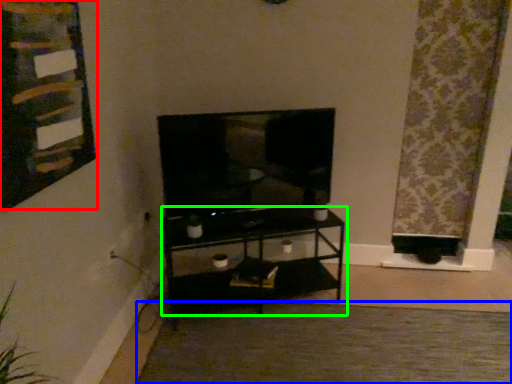
Question: Based on their relative distances, which object is nearer to bulletin board (highlighted by a red box)? Choose from plain (highlighted by a blue box) and shelf (highlighted by a green box).

Choices:
 (A) plain
 (B) shelf

Answer: (B)